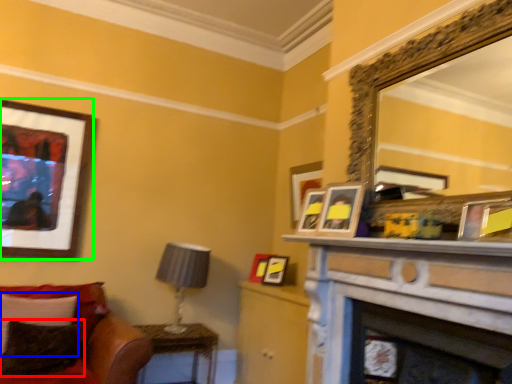
Question: Considering the real-world distances, which object is closest to pillow (highlighted by a red box)? pillow (highlighted by a blue box) or picture frame (highlighted by a green box).

Choices:
 (A) pillow
 (B) picture frame

Answer: (A)